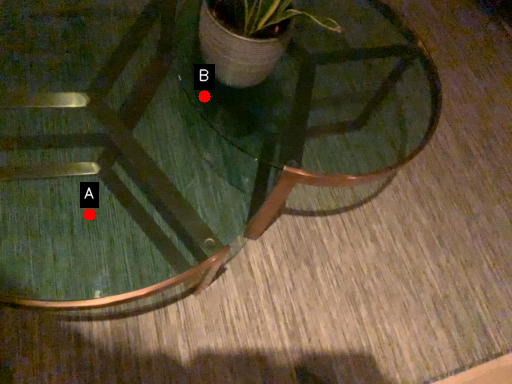
Question: Two points are circled on the image, labeled by A and B beside each circle. Among these points, which one is nearest to the camera?

Choices:
 (A) A is closer
 (B) B is closer

Answer: (A)